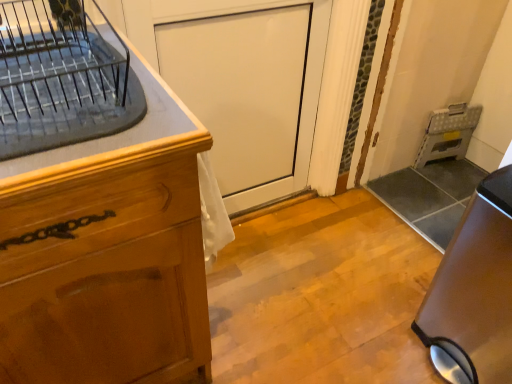
Question: From the image's perspective, is metallic gray folding step stool at right under white glossy door at center?

Choices:
 (A) yes
 (B) no

Answer: (B)

Question: Considering the relative positions of metallic gray folding step stool at right and white glossy door at center in the image provided, is metallic gray folding step stool at right to the right of white glossy door at center from the viewer's perspective?

Choices:
 (A) yes
 (B) no

Answer: (A)

Question: From the image's perspective, does metallic gray folding step stool at right appear higher than white glossy door at center?

Choices:
 (A) yes
 (B) no

Answer: (A)

Question: Is metallic gray folding step stool at right outside of white glossy door at center?

Choices:
 (A) yes
 (B) no

Answer: (A)

Question: Is metallic gray folding step stool at right turned away from white glossy door at center?

Choices:
 (A) yes
 (B) no

Answer: (B)

Question: From a real-world perspective, is metallic gray folding step stool at right on top of white glossy door at center?

Choices:
 (A) no
 (B) yes

Answer: (A)

Question: Are satin brown trash can at lower right and wooden cabinet at left making contact?

Choices:
 (A) no
 (B) yes

Answer: (A)

Question: From the image's perspective, is satin brown trash can at lower right below wooden cabinet at left?

Choices:
 (A) yes
 (B) no

Answer: (A)

Question: Does satin brown trash can at lower right have a lesser width compared to wooden cabinet at left?

Choices:
 (A) no
 (B) yes

Answer: (B)

Question: Is satin brown trash can at lower right at the right side of wooden cabinet at left?

Choices:
 (A) yes
 (B) no

Answer: (A)

Question: Does satin brown trash can at lower right have a larger size compared to wooden cabinet at left?

Choices:
 (A) no
 (B) yes

Answer: (A)

Question: Is satin brown trash can at lower right positioned with its back to wooden cabinet at left?

Choices:
 (A) no
 (B) yes

Answer: (A)

Question: Is clear glass dish rack at upper left at the left side of satin brown trash can at lower right?

Choices:
 (A) no
 (B) yes

Answer: (B)